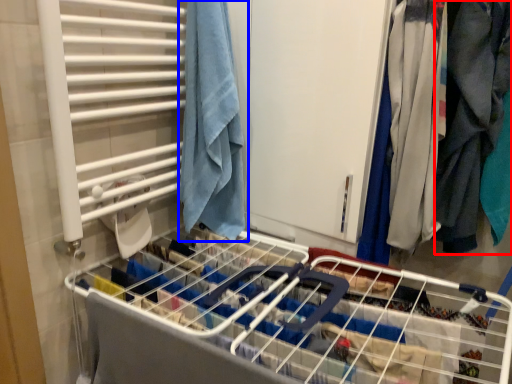
Question: Among these objects, which one is nearest to the camera, clothing (highlighted by a red box) or towel (highlighted by a blue box)?

Choices:
 (A) clothing
 (B) towel

Answer: (A)